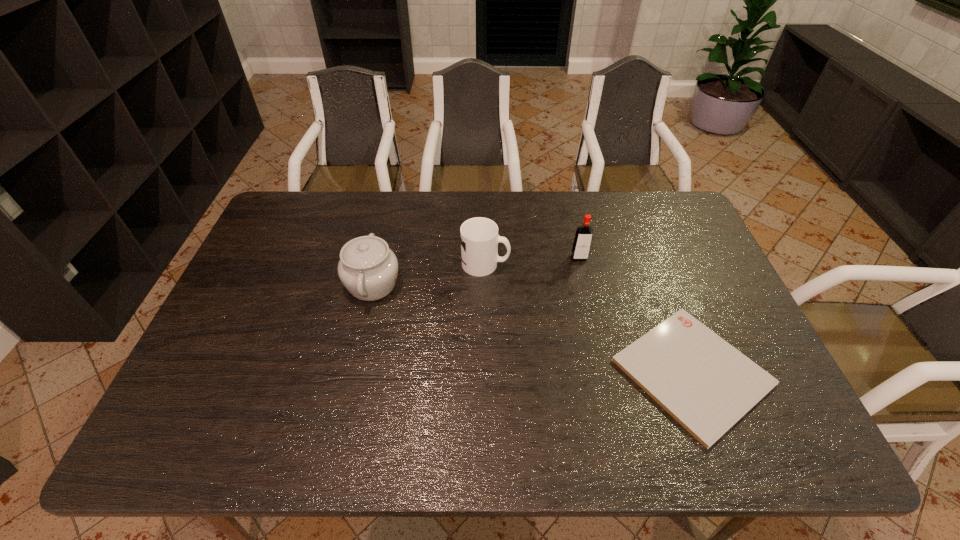
Where is `object at the near right corner`? The height and width of the screenshot is (540, 960). object at the near right corner is located at coordinates (704, 383).

Identify the location of vacant area at the far edge. This screenshot has width=960, height=540. (520, 225).

In the image, there is a desktop. At what (x,y) coordinates should I click in order to perform the action: click on vacant space at the near edge. Please return your answer as a coordinate pair (x, y). The height and width of the screenshot is (540, 960). Looking at the image, I should click on (427, 420).

Identify the location of vacant space at the left edge of the desktop. Image resolution: width=960 pixels, height=540 pixels. (257, 245).

What are the coordinates of `free space between the chinaware and the clipboard` in the screenshot? It's located at (533, 328).

This screenshot has width=960, height=540. I want to click on empty location between the shortest object and the vodka, so click(636, 315).

Image resolution: width=960 pixels, height=540 pixels. I want to click on free space that is in between the shortest object and the second object from left to right, so click(588, 318).

Image resolution: width=960 pixels, height=540 pixels. In order to click on free space that is in between the second object from left to right and the shortest object in this screenshot , I will do `click(588, 318)`.

This screenshot has width=960, height=540. I want to click on vacant point located between the chinaware and the third object from right to left, so click(429, 274).

Find the location of `vacant area that lies between the vodka and the clipboard`. vacant area that lies between the vodka and the clipboard is located at coordinates click(636, 315).